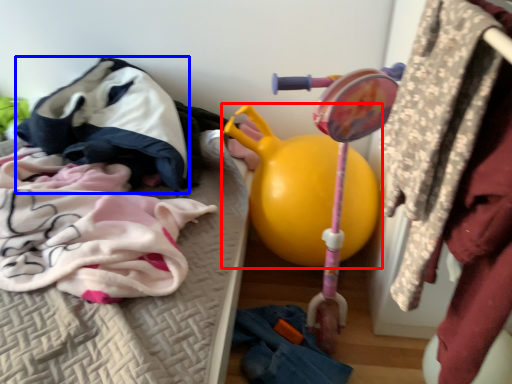
Question: Which of the following is the closest to the observer, toy (highlighted by a red box) or clothing (highlighted by a blue box)?

Choices:
 (A) toy
 (B) clothing

Answer: (A)